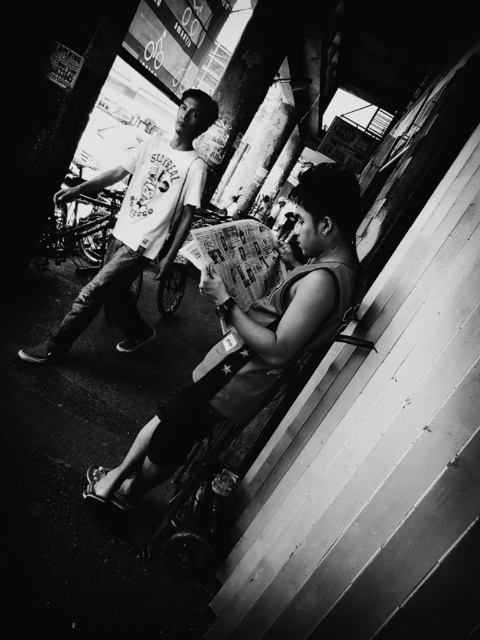
Who is higher up, wooden stair at lower right or matte white t-shirt at center?

matte white t-shirt at center is higher up.

Who is more distant from viewer, (x=372, y=522) or (x=166, y=188)?

The point (x=166, y=188) is more distant.

The width and height of the screenshot is (480, 640). In order to click on wooden stair at lower right in this screenshot , I will do `click(372, 444)`.

The height and width of the screenshot is (640, 480). In order to click on wooden stair at lower right in this screenshot , I will do `click(372, 444)`.

Does smooth paper newspaper at center appear on the right side of matte white t-shirt at center?

Indeed, smooth paper newspaper at center is positioned on the right side of matte white t-shirt at center.

Which is in front, point (283, 296) or point (121, 221)?

Point (283, 296) is more forward.

At what (x,y) coordinates should I click in order to perform the action: click on smooth paper newspaper at center. Please return your answer as a coordinate pair (x, y). The image size is (480, 640). Looking at the image, I should click on (252, 339).

Between wooden stair at lower right and smooth paper newspaper at center, which one has less height?

With less height is smooth paper newspaper at center.

Does wooden stair at lower right lie in front of smooth paper newspaper at center?

Yes, it is.

Image resolution: width=480 pixels, height=640 pixels. What do you see at coordinates (372, 444) in the screenshot?
I see `wooden stair at lower right` at bounding box center [372, 444].

At what (x,y) coordinates should I click in order to perform the action: click on wooden stair at lower right. Please return your answer as a coordinate pair (x, y). The width and height of the screenshot is (480, 640). Looking at the image, I should click on (372, 444).